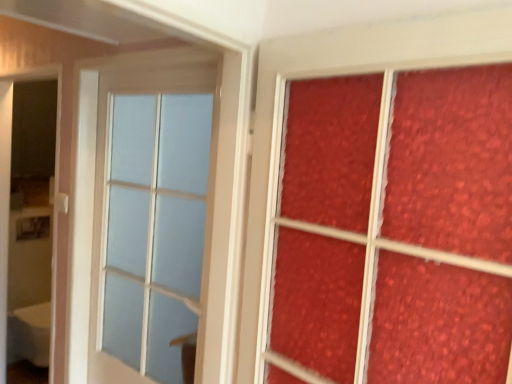
Question: From a real-world perspective, is matte textured glass at right located beneath white glossy screen door at left?

Choices:
 (A) no
 (B) yes

Answer: (A)

Question: Is matte textured glass at right to the right of white glossy screen door at left from the viewer's perspective?

Choices:
 (A) no
 (B) yes

Answer: (B)

Question: Considering the relative sizes of matte textured glass at right and white glossy screen door at left in the image provided, is matte textured glass at right smaller than white glossy screen door at left?

Choices:
 (A) yes
 (B) no

Answer: (A)

Question: Can you confirm if matte textured glass at right is taller than white glossy screen door at left?

Choices:
 (A) no
 (B) yes

Answer: (A)

Question: Is matte textured glass at right facing away from white glossy screen door at left?

Choices:
 (A) no
 (B) yes

Answer: (A)

Question: From the image's perspective, is matte textured glass at right located beneath white glossy screen door at left?

Choices:
 (A) no
 (B) yes

Answer: (A)

Question: Does matte textured glass at right have a lesser height compared to matte glass window at center?

Choices:
 (A) no
 (B) yes

Answer: (B)

Question: Is matte textured glass at right turned away from matte glass window at center?

Choices:
 (A) no
 (B) yes

Answer: (A)

Question: Is matte textured glass at right far from matte glass window at center?

Choices:
 (A) yes
 (B) no

Answer: (B)

Question: Is matte textured glass at right thinner than matte glass window at center?

Choices:
 (A) yes
 (B) no

Answer: (A)

Question: Does matte textured glass at right have a smaller size compared to matte glass window at center?

Choices:
 (A) no
 (B) yes

Answer: (B)

Question: Are matte textured glass at right and matte glass window at center making contact?

Choices:
 (A) yes
 (B) no

Answer: (B)

Question: Is matte glass window at center shorter than white glossy screen door at left?

Choices:
 (A) yes
 (B) no

Answer: (A)